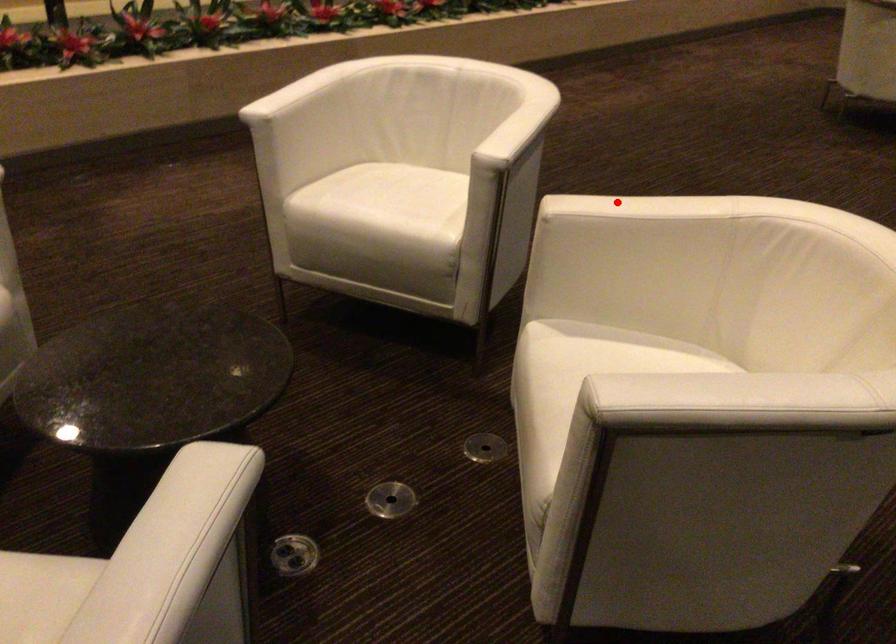
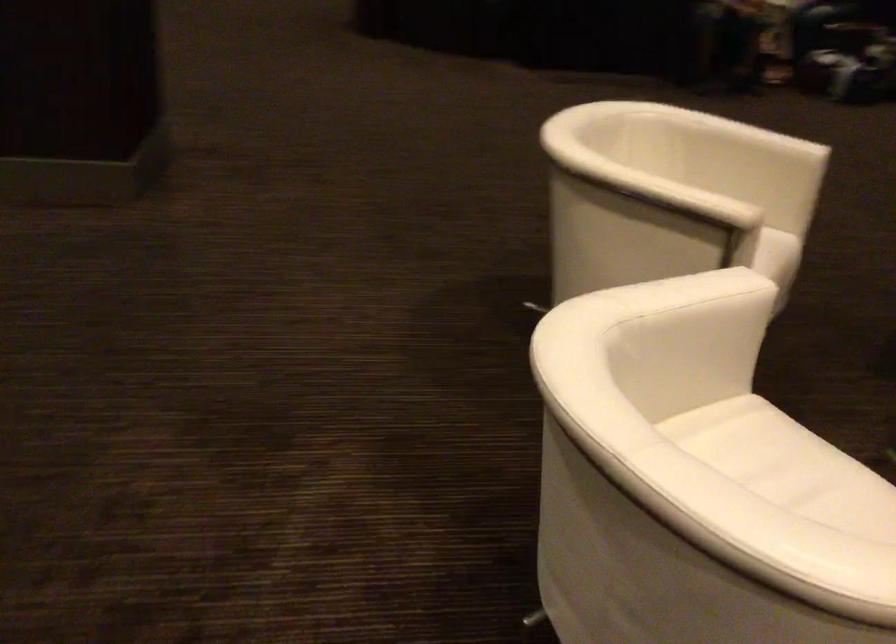
Find the pixel in the second image that matches the highlighted location in the first image.

(675, 194)